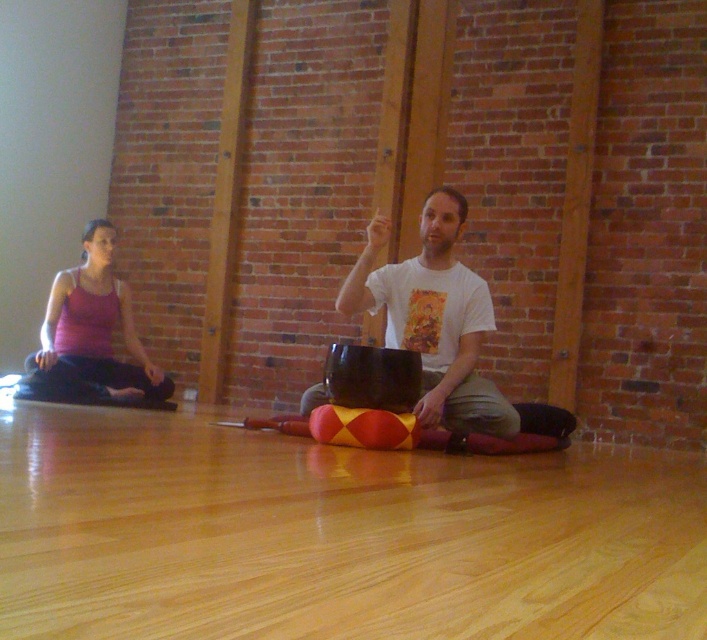
You are standing in the room where the two people are sitting. You notice a point marked at coordinates (433, 317). Which object does this point correspond to?

The point at coordinates (433, 317) corresponds to the white matte tshirt at center.